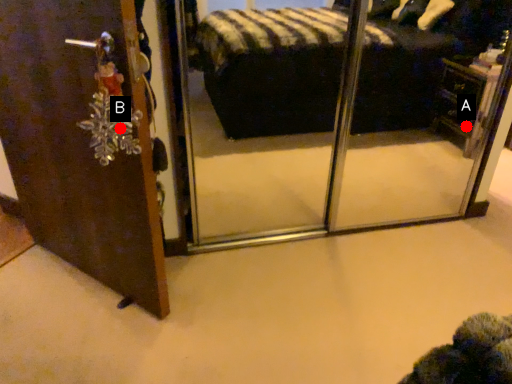
Question: Two points are circled on the image, labeled by A and B beside each circle. Which point is farther to the camera?

Choices:
 (A) A is further
 (B) B is further

Answer: (A)